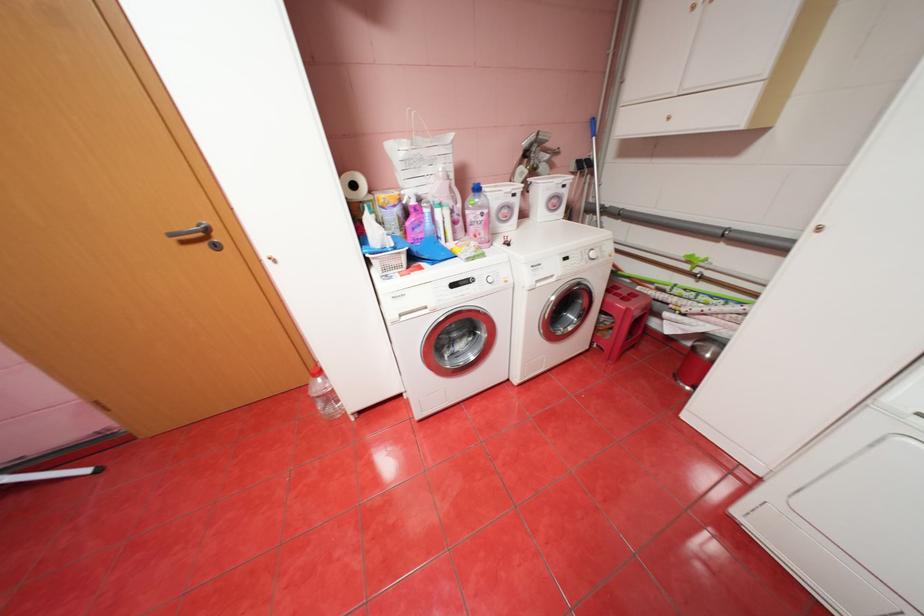
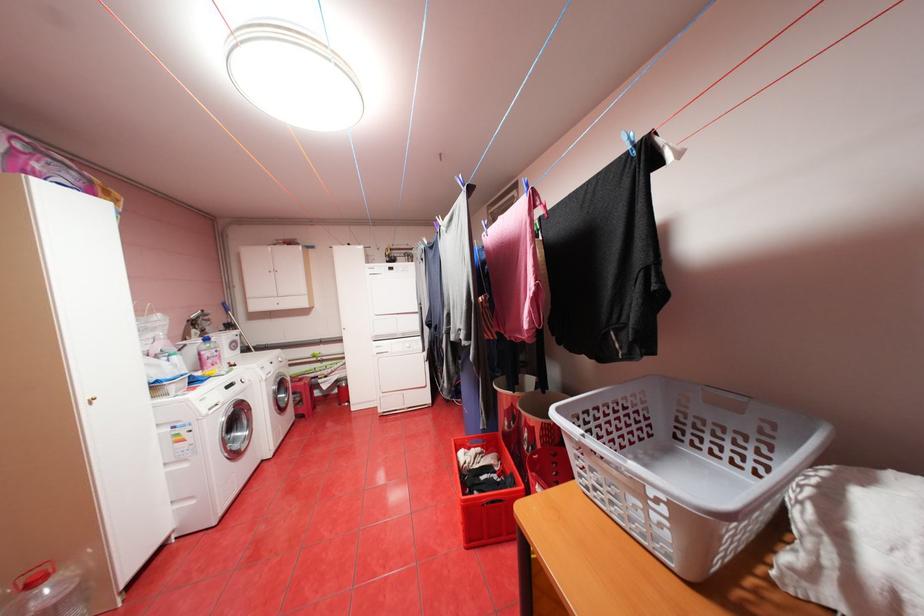
Question: I am providing you with two images of the same scene from different viewpoints. After the viewpoint changes to image2, which objects are now occluded?

Choices:
 (A) small black ball
 (B) paper towel roll
 (C) washing machine door
 (D) grey basket handle

Answer: (B)